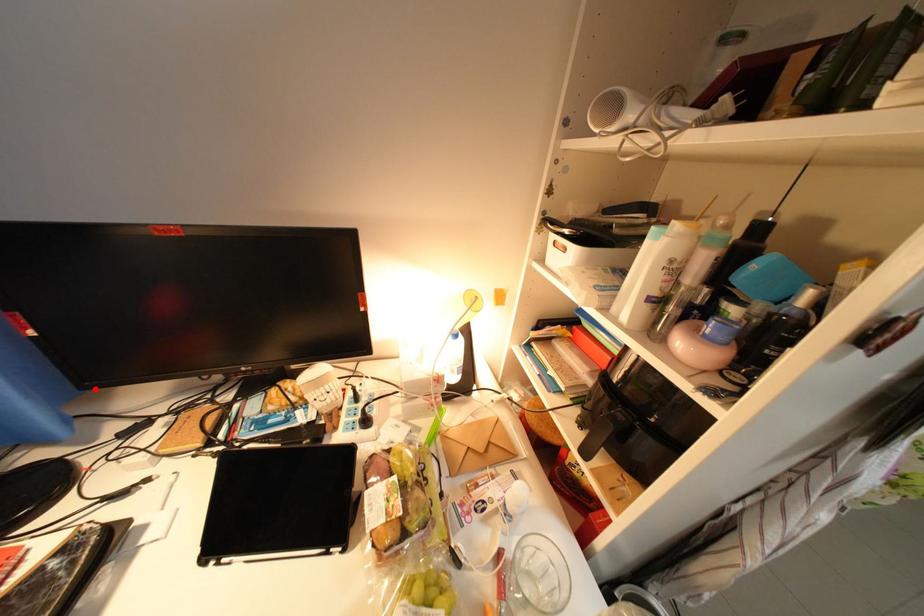
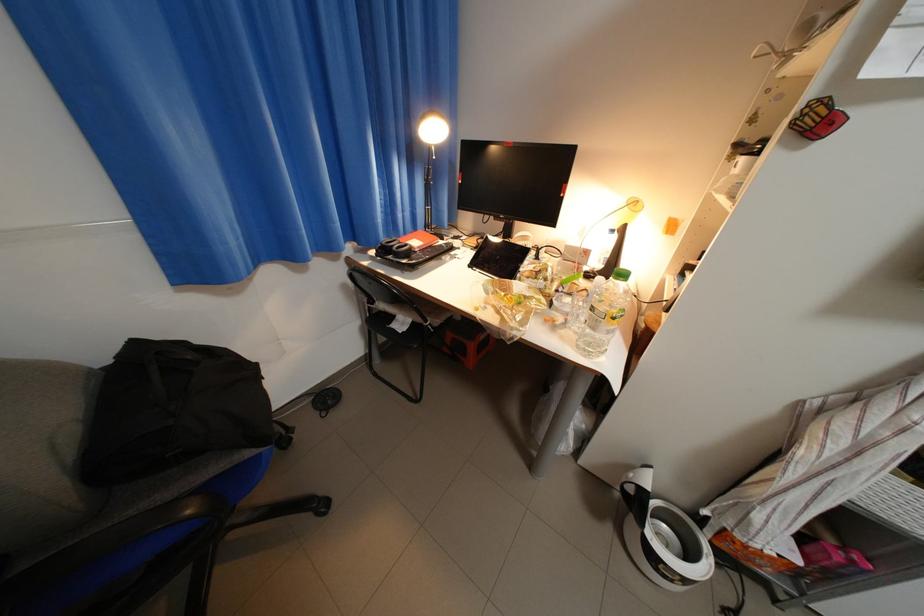
Question: I am providing you with two images of the same scene from different viewpoints. In image1, a red point is highlighted. Considering the same 3D point in image2, which of the following is correct?

Choices:
 (A) It is closer
 (B) It is farther

Answer: (A)